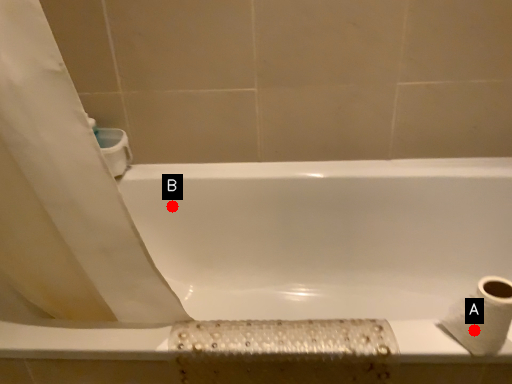
Question: Two points are circled on the image, labeled by A and B beside each circle. Which point is farther to the camera?

Choices:
 (A) A is further
 (B) B is further

Answer: (B)